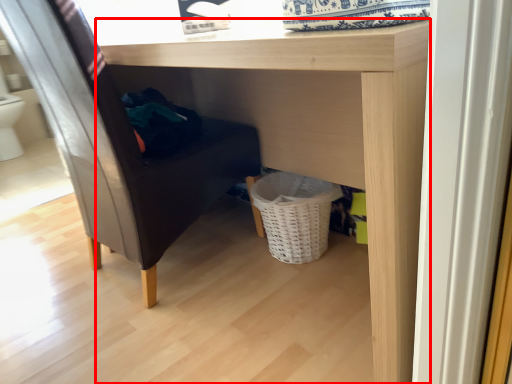
Question: From the image, what is the correct spatial relationship of table (annotated by the red box) in relation to furniture?

Choices:
 (A) left
 (B) right

Answer: (B)